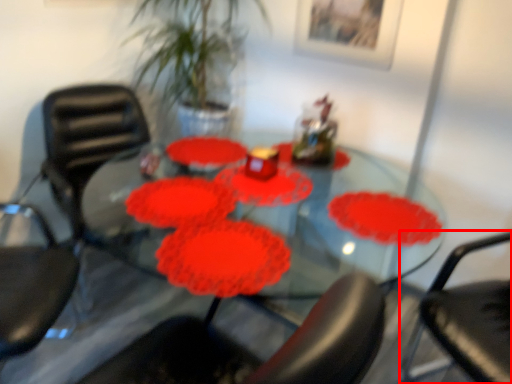
Question: Where is chair (annotated by the red box) located in relation to chair in the image?

Choices:
 (A) right
 (B) left

Answer: (A)